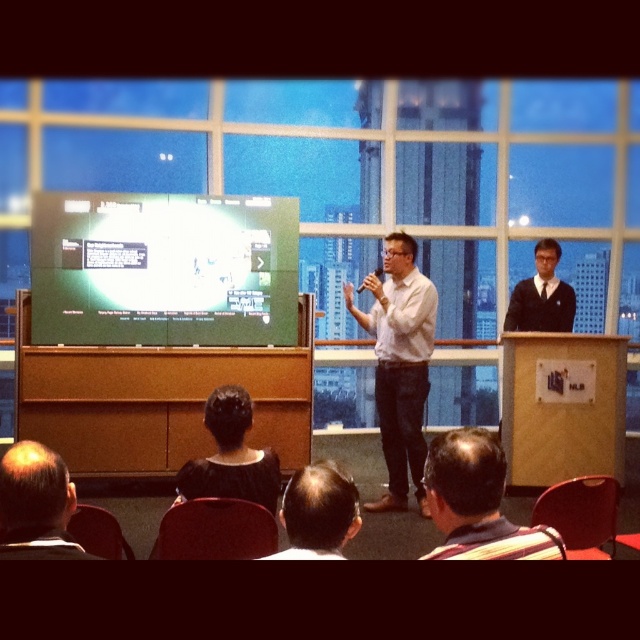
Who is taller, bald head at lower left or dark brown hair at lower center?

Standing taller between the two is bald head at lower left.

Is point (35, 486) farther from camera compared to point (301, 509)?

No, it is not.

Between point (45, 465) and point (314, 486), which one is positioned in front?

Point (314, 486) is more forward.

You are a GUI agent. You are given a task and a screenshot of the screen. Output one action in this format:
    pyautogui.click(x=<x>, y=<y>)
    Task: Click on the bald head at lower left
    The width and height of the screenshot is (640, 640).
    Given the screenshot: What is the action you would take?
    pyautogui.click(x=36, y=504)

Does green matte projection screen at center appear under bald head at lower left?

Actually, green matte projection screen at center is above bald head at lower left.

Is green matte projection screen at center bigger than bald head at lower left?

Indeed, green matte projection screen at center has a larger size compared to bald head at lower left.

Is point (150, 298) positioned before point (10, 493)?

No, it is not.

Image resolution: width=640 pixels, height=640 pixels. Find the location of `green matte projection screen at center`. green matte projection screen at center is located at coordinates (163, 269).

Who is taller, white shirt at center or dark brown hair at lower center?

Standing taller between the two is white shirt at center.

Who is more forward, (420, 321) or (316, 490)?

Point (316, 490) is more forward.

I want to click on white shirt at center, so click(400, 364).